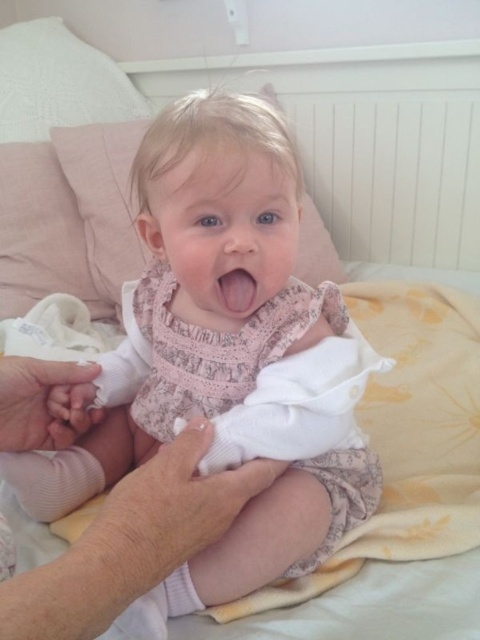
Question: Which point is farther to the camera?

Choices:
 (A) (381, 368)
 (B) (151, 312)
 (C) (238, 268)

Answer: (B)

Question: Can you confirm if pink fabric baby at center is positioned to the right of white cotton diaper at center?

Choices:
 (A) yes
 (B) no

Answer: (B)

Question: Which object is the farthest from the pink glossy lips at center?

Choices:
 (A) pink fabric baby at center
 (B) white cotton diaper at center

Answer: (A)

Question: Is white cotton diaper at center smaller than pink glossy lips at center?

Choices:
 (A) no
 (B) yes

Answer: (A)

Question: Which object is the farthest from the pink glossy lips at center?

Choices:
 (A) white cotton diaper at center
 (B) pink fabric baby at center

Answer: (B)

Question: Is pink fabric baby at center thinner than white cotton diaper at center?

Choices:
 (A) yes
 (B) no

Answer: (B)